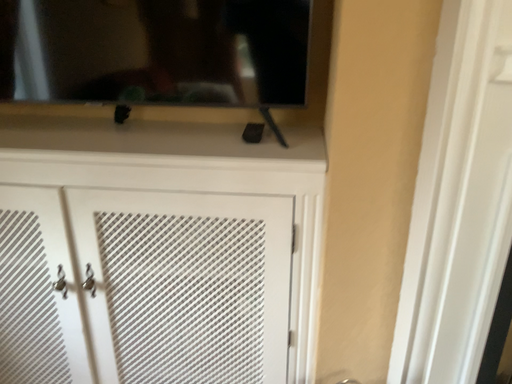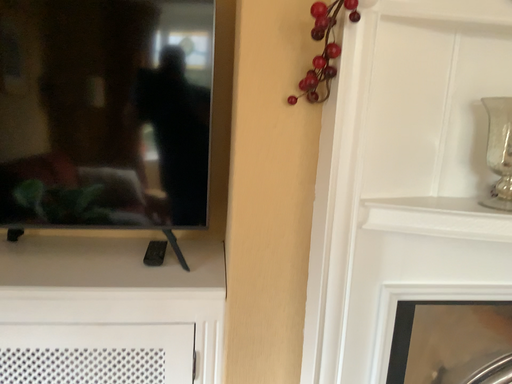
Question: How did the camera likely rotate when shooting the video?

Choices:
 (A) rotated right
 (B) rotated left

Answer: (A)